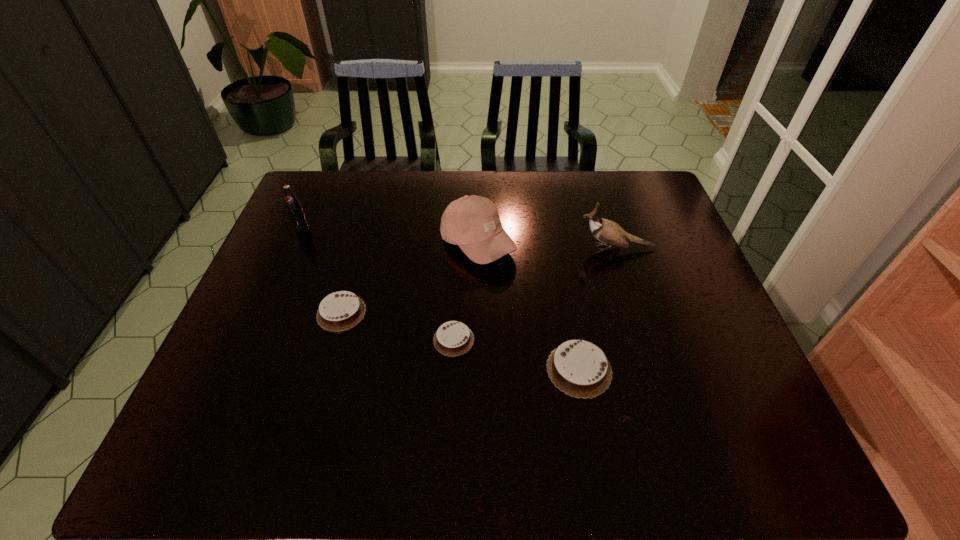
This screenshot has height=540, width=960. I want to click on the second shortest object, so click(339, 311).

You are a GUI agent. You are given a task and a screenshot of the screen. Output one action in this format:
    pyautogui.click(x=<x>, y=<y>)
    Task: Click on the leftmost chocolate cake
    
    Given the screenshot: What is the action you would take?
    pyautogui.click(x=339, y=311)

In order to click on the second chocolate cake from right to left in this screenshot , I will do `click(453, 338)`.

The width and height of the screenshot is (960, 540). I want to click on the shortest chocolate cake, so coord(453,338).

This screenshot has width=960, height=540. In order to click on the tallest chocolate cake in this screenshot , I will do `click(579, 368)`.

The image size is (960, 540). I want to click on the fourth tallest object, so click(x=579, y=368).

Locate an element on the screen. baseball cap is located at coordinates (472, 222).

The height and width of the screenshot is (540, 960). What are the coordinates of `bird` in the screenshot? It's located at (606, 231).

Where is `the leftmost object`? This screenshot has height=540, width=960. the leftmost object is located at coordinates (295, 211).

This screenshot has width=960, height=540. What are the coordinates of `free space located on the front of the second shortest chocolate cake` in the screenshot? It's located at (316, 404).